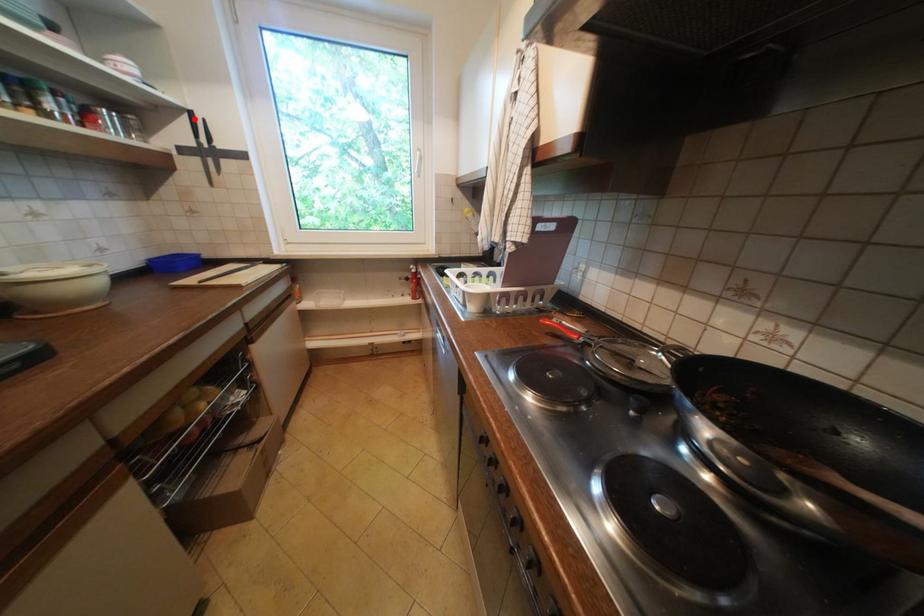
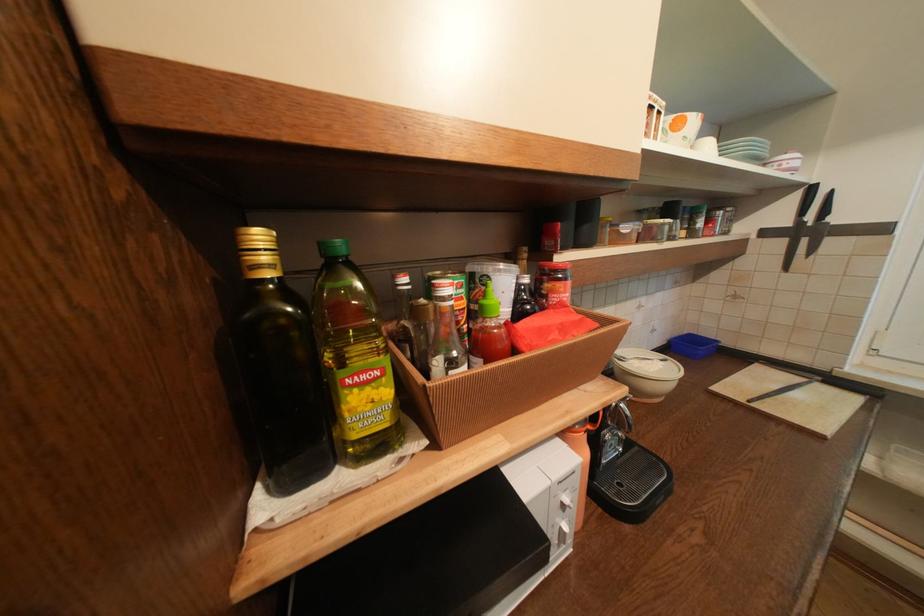
Where in the second image is the point corresponding to the highlighted location from the first image?

(807, 196)